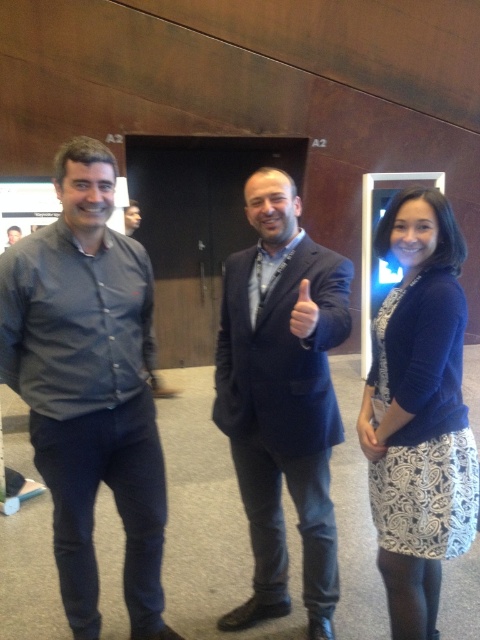
Question: Can you confirm if dark gray shirt at left is wider than dark blue suit at center?

Choices:
 (A) yes
 (B) no

Answer: (A)

Question: Does dark gray shirt at left have a larger size compared to dark blue sweater at right?

Choices:
 (A) yes
 (B) no

Answer: (A)

Question: Which object is closer to the camera taking this photo?

Choices:
 (A) dark blue suit at center
 (B) dark gray shirt at left
 (C) dark blue sweater at right
 (D) matte black shirt at left

Answer: (A)

Question: Among these points, which one is farthest from the camera?

Choices:
 (A) (12, 230)
 (B) (91, 332)
 (C) (377, 392)

Answer: (A)

Question: Estimate the real-world distances between objects in this image. Which object is closer to the dark blue suit at center?

Choices:
 (A) dark blue sweater at right
 (B) dark gray shirt at left

Answer: (A)

Question: Does dark gray shirt at left appear over matte black shirt at left?

Choices:
 (A) yes
 (B) no

Answer: (B)